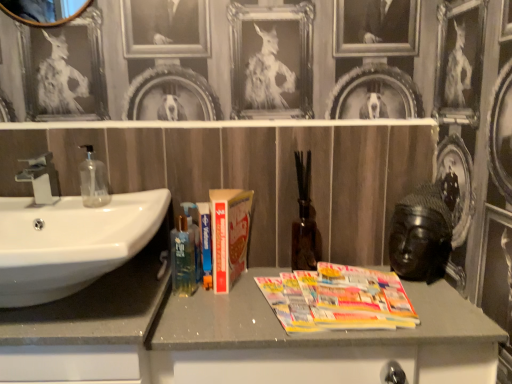
At what (x,y) coordinates should I click in order to perform the action: click on unoccupied region to the right of matte silver faucet at left. Please return your answer as a coordinate pair (x, y). The height and width of the screenshot is (384, 512). Looking at the image, I should click on (101, 200).